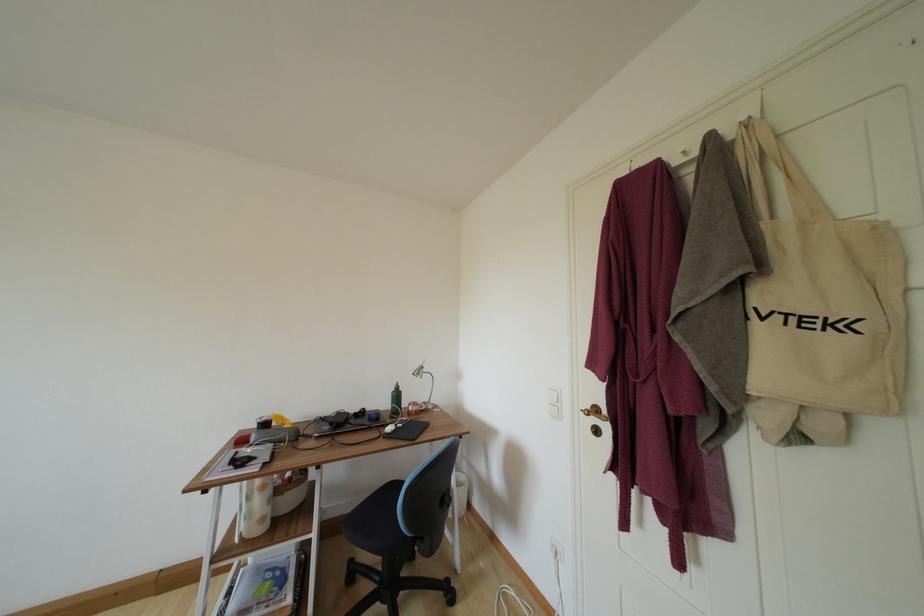
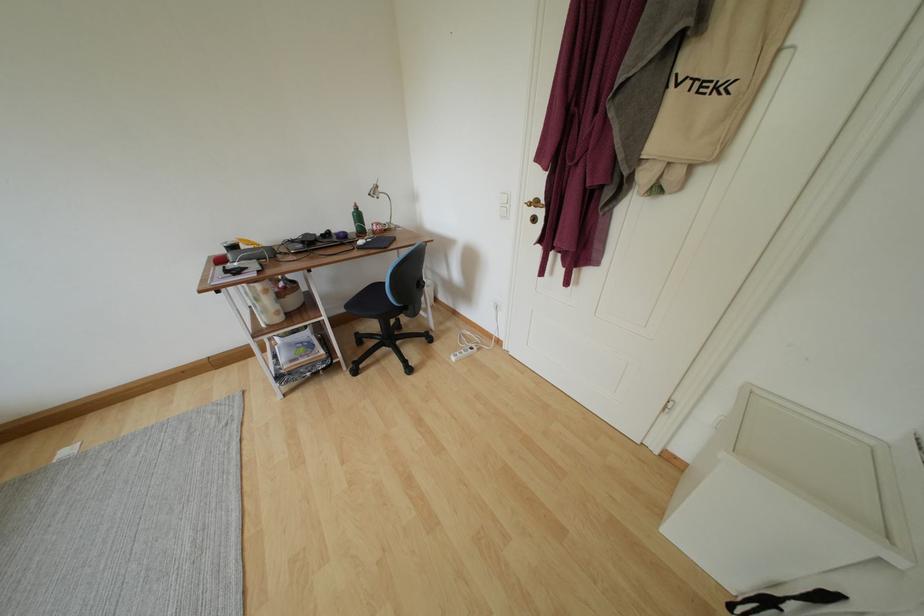
Find the pixel in the second image that matches [371,421] in the first image.

(339, 241)